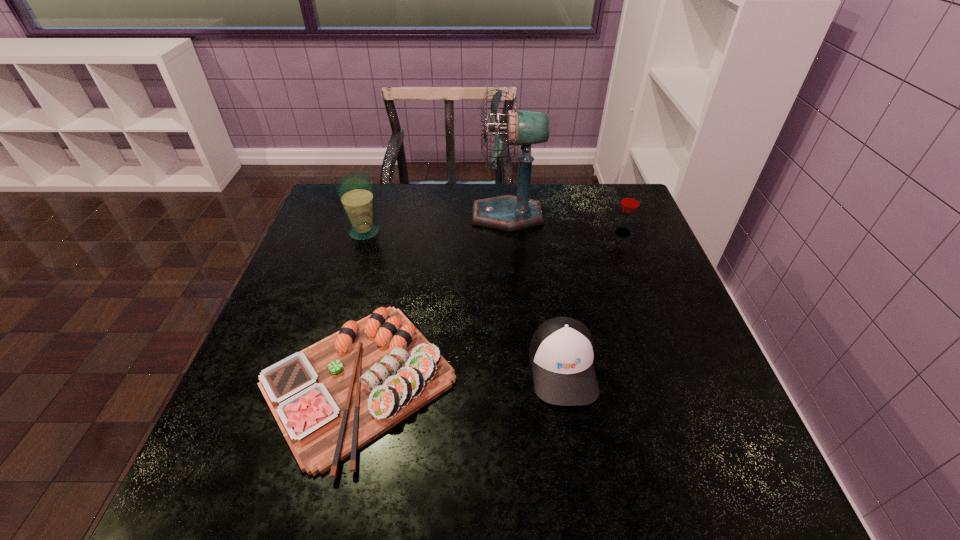
I want to click on blank space located on the front of the left glass, so click(x=350, y=278).

I want to click on vacant area situated 0.190m on the front of the rightmost object, so click(x=643, y=286).

Locate an element on the screen. blank space located on the front panel of the second shortest object is located at coordinates (576, 444).

Identify the location of vacant space located 0.050m on the right of the shortest object. This screenshot has width=960, height=540. (481, 382).

Locate an element on the screen. The height and width of the screenshot is (540, 960). fan that is positioned at the far edge is located at coordinates coord(509,213).

The image size is (960, 540). What are the coordinates of `object positioned at the near edge` in the screenshot? It's located at pos(331,399).

The height and width of the screenshot is (540, 960). I want to click on glass that is at the left edge, so click(x=355, y=190).

Locate an element on the screen. The height and width of the screenshot is (540, 960). platter present at the left edge is located at coordinates (331, 399).

The height and width of the screenshot is (540, 960). Identify the location of object present at the right edge. (630, 202).

Locate an element on the screen. object located at the far left corner is located at coordinates (355, 190).